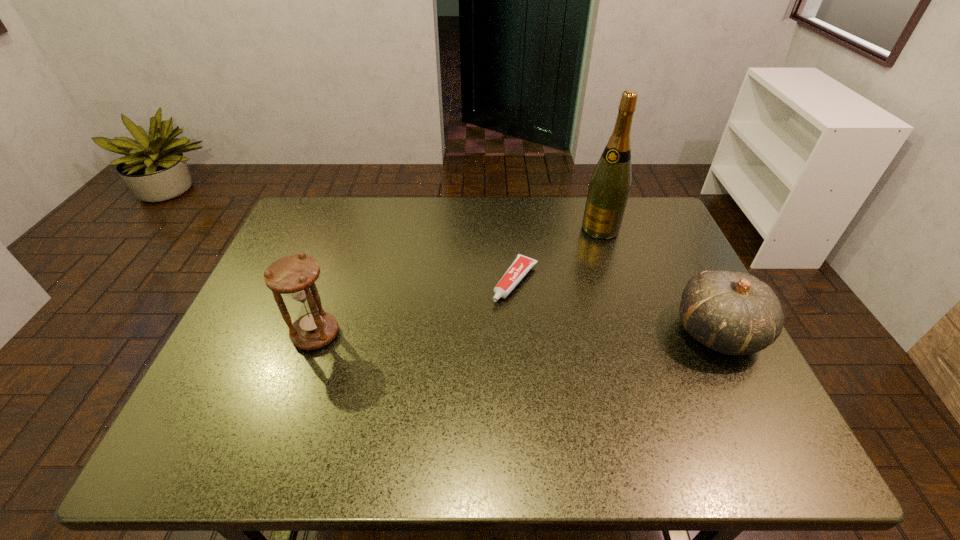
Locate an element on the screen. The width and height of the screenshot is (960, 540). free spot on the desktop that is between the second tallest object and the gourd and is positioned on the front-facing side of the third object from left to right is located at coordinates (516, 333).

Locate an element on the screen. The image size is (960, 540). vacant space on the desktop that is between the hourglass and the second shortest object and is positioned at the nozzle of the toothpaste is located at coordinates (475, 333).